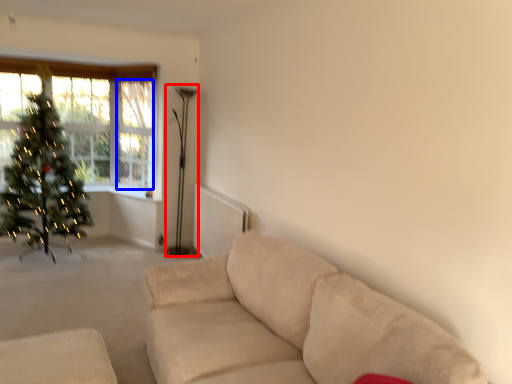
Question: Among these objects, which one is nearest to the camera, lamp (highlighted by a red box) or window screen (highlighted by a blue box)?

Choices:
 (A) lamp
 (B) window screen

Answer: (A)